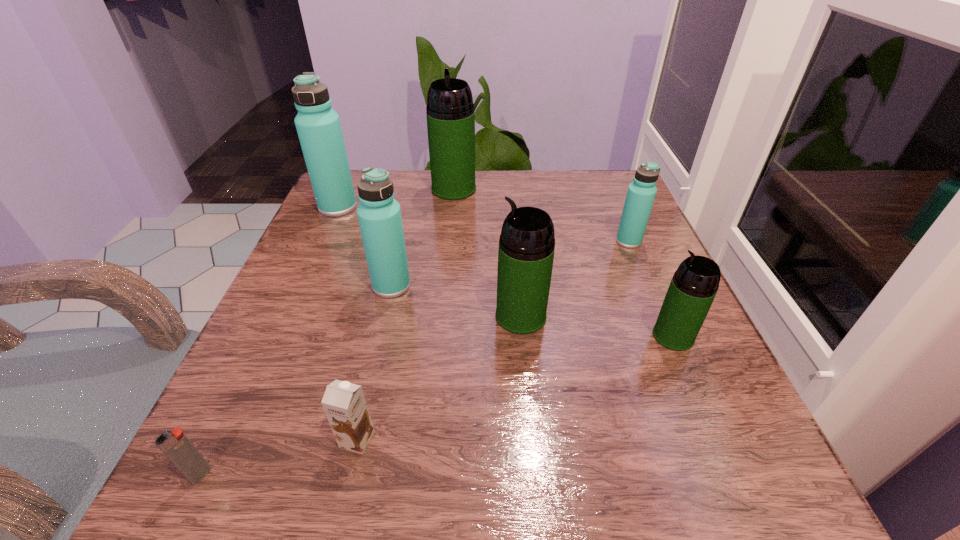
You are a GUI agent. You are given a task and a screenshot of the screen. Output one action in this format:
    pyautogui.click(x=<x>, y=<y>)
    Task: Click on the free location located 0.080m from the spout of the fourth thermos bottle from left to right
    The height and width of the screenshot is (540, 960).
    Given the screenshot: What is the action you would take?
    pyautogui.click(x=450, y=316)

Locate an element on the screen. Image resolution: width=960 pixels, height=540 pixels. vacant region located 0.290m on the back of the second nearest aqua thermos bottle is located at coordinates (x=599, y=171).

Locate an element on the screen. vacant space located from the spout of the smallest green thermos bottle is located at coordinates (617, 336).

Where is `blank area located 0.270m from the spout of the smallest green thermos bottle`? This screenshot has width=960, height=540. blank area located 0.270m from the spout of the smallest green thermos bottle is located at coordinates (492, 336).

The width and height of the screenshot is (960, 540). Identify the location of vacant space located 0.370m from the spout of the smallest green thermos bottle. (433, 336).

The image size is (960, 540). Find the location of `vacant space located on the right of the chocolate milk`. vacant space located on the right of the chocolate milk is located at coordinates (549, 439).

Identify the location of vacant region located 0.220m on the back of the igniter. The height and width of the screenshot is (540, 960). (267, 336).

Locate an element on the screen. The image size is (960, 540). chocolate milk at the near edge is located at coordinates (344, 403).

Locate an element on the screen. This screenshot has height=540, width=960. igniter present at the near edge is located at coordinates (177, 447).

Locate an element on the screen. The image size is (960, 540). thermos bottle present at the left edge is located at coordinates (318, 126).